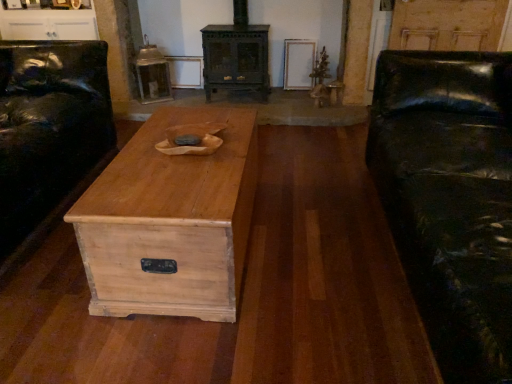
Locate an element on the screen. This screenshot has height=384, width=512. vacant area in front of natural wood chest at center is located at coordinates (187, 341).